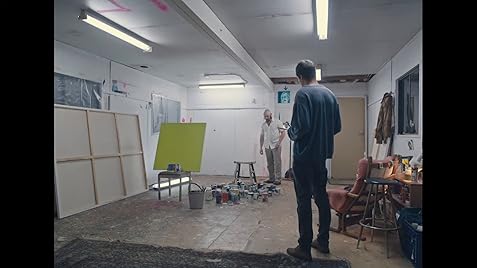
You are a GUI agent. You are given a task and a screenshot of the screen. Output one action in this format:
    pyautogui.click(x=<x>, y=<y>)
    Task: Click on the stool
    
    Given the screenshot: What is the action you would take?
    coord(382,183)